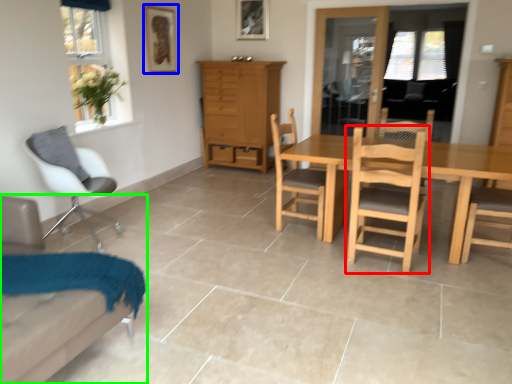
Question: Considering the real-world distances, which object is closest to chair (highlighted by a red box)? picture frame (highlighted by a blue box) or chair (highlighted by a green box).

Choices:
 (A) picture frame
 (B) chair

Answer: (B)